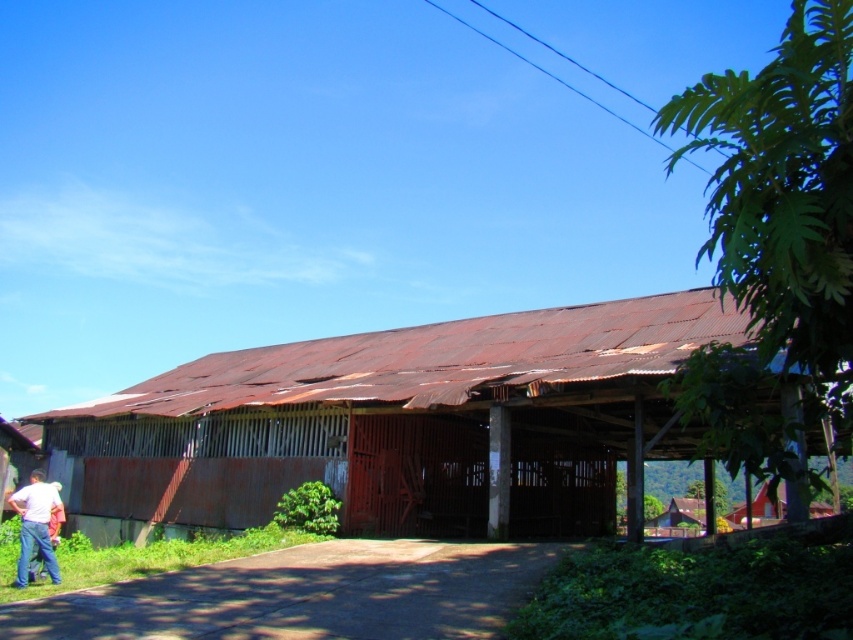
You are standing in a field and see the rusty corrugated metal barn at center and the white matte shirt at lower left. Which object is closer to you?

The rusty corrugated metal barn at center is closer to you because it is in front of the white matte shirt at lower left.

You are standing in front of the rusty corrugated metal barn at center and the white matte shirt at lower left. Which object is positioned higher from the ground?

The rusty corrugated metal barn at center is positioned higher from the ground than the white matte shirt at lower left because it is above it.